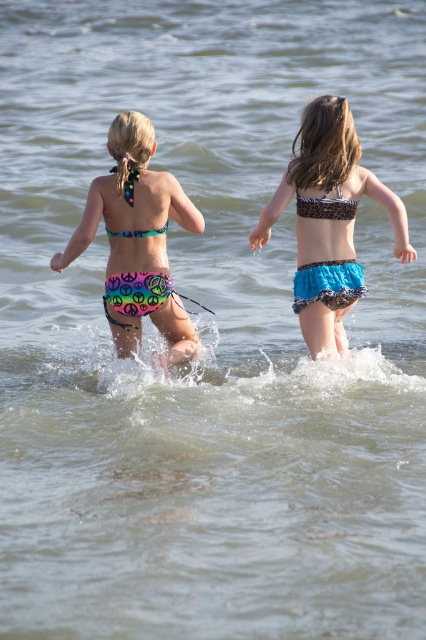
Is rainbow fabric bikini at center positioned in front of blue textured bikini at center?

That is True.

Find the location of a particular element. This screenshot has height=640, width=426. rainbow fabric bikini at center is located at coordinates (137, 241).

Is point (143, 212) positioned after point (321, 266)?

No, (143, 212) is in front of (321, 266).

What are the coordinates of `rainbow fabric bikini at center` in the screenshot? It's located at (137, 241).

Between blue ruffled bikini at center and blue textured bikini at center, which one is positioned higher?

blue ruffled bikini at center is higher up.

Measure the distance between blue ruffled bikini at center and camera.

blue ruffled bikini at center is 22.17 feet from camera.

Find the location of a particular element. This screenshot has width=426, height=640. blue ruffled bikini at center is located at coordinates (328, 220).

Which is below, blue textured bikini at center or peace sign print bikini at center?

blue textured bikini at center is below.

Between blue textured bikini at center and peace sign print bikini at center, which one has less height?

blue textured bikini at center is shorter.

Where is `blue textured bikini at center`? The image size is (426, 640). blue textured bikini at center is located at coordinates (328, 284).